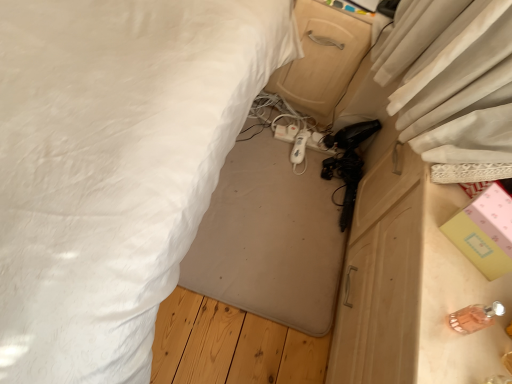
The height and width of the screenshot is (384, 512). What do you see at coordinates (114, 166) in the screenshot? I see `white fabric bed at center` at bounding box center [114, 166].

Find the location of a particular element. Image resolution: width=512 pixels, height=384 pixels. white matte remote control at center, positioned as the 2th equipment in right-to-left order is located at coordinates (298, 146).

Can you tell me how much white matte remote control at center, the 2th equipment from the front, and pink paper box at right differ in facing direction?

The facing directions of white matte remote control at center, the 2th equipment from the front, and pink paper box at right are 39 degrees apart.

In the scene shown: Does white matte remote control at center, positioned as the 2th equipment in right-to-left order, have a greater width compared to pink paper box at right?

Indeed, white matte remote control at center, positioned as the 2th equipment in right-to-left order, has a greater width compared to pink paper box at right.

Is white matte remote control at center, positioned as the first equipment in top-to-bottom order, directly adjacent to pink paper box at right?

They are not placed beside each other.

Who is shorter, white matte remote control at center, the 1th equipment from the left, or pink paper box at right?

With less height is white matte remote control at center, the 1th equipment from the left.

In the scene shown: Is wooden drawer at center in front of or behind translucent glass perfume bottle at lower right, which is the 2th equipment in back-to-front order, in the image?

wooden drawer at center is positioned farther from the viewer than translucent glass perfume bottle at lower right, which is the 2th equipment in back-to-front order.

Locate an element on the screen. equipment in front of the wooden drawer at center is located at coordinates (475, 317).

Which of these two, wooden drawer at center or translucent glass perfume bottle at lower right, the 2th equipment positioned from the left, stands taller?

Standing taller between the two is wooden drawer at center.

Can you tell me how much wooden drawer at center and translucent glass perfume bottle at lower right, marked as the first equipment in a front-to-back arrangement, differ in facing direction?

The facing directions of wooden drawer at center and translucent glass perfume bottle at lower right, marked as the first equipment in a front-to-back arrangement, are 86.8 degrees apart.

Is white plastic extension cord at center not within white fabric bed at center?

That's incorrect, white plastic extension cord at center is not completely outside white fabric bed at center.

Can you tell me how much white plastic extension cord at center and white fabric bed at center differ in facing direction?

The angle between the facing direction of white plastic extension cord at center and the facing direction of white fabric bed at center is 174 degrees.

Considering the relative sizes of white plastic extension cord at center and white fabric bed at center in the image provided, is white plastic extension cord at center bigger than white fabric bed at center?

No.

Is white plastic extension cord at center far from white fabric bed at center?

No, white plastic extension cord at center is not far from white fabric bed at center.

Is pink paper box at right completely or partially outside of wooden drawer at center?

pink paper box at right lies outside wooden drawer at center's area.

Considering the sizes of objects pink paper box at right and wooden drawer at center in the image provided, who is bigger, pink paper box at right or wooden drawer at center?

Bigger between the two is wooden drawer at center.

Is pink paper box at right further to the viewer compared to wooden drawer at center?

No, pink paper box at right is in front of wooden drawer at center.

From a real-world perspective, which is physically below, pink paper box at right or wooden drawer at center?

wooden drawer at center, from a real-world perspective.

From a real-world perspective, which is physically below, translucent glass perfume bottle at lower right, arranged as the 1th equipment when viewed from the right, or wooden drawer at center?

In real-world perspective, wooden drawer at center is lower.

Find the location of a particular element. equipment in front of the wooden drawer at center is located at coordinates (475, 317).

Are translucent glass perfume bottle at lower right, the 1th equipment ordered from the bottom, and wooden drawer at center beside each other?

No, translucent glass perfume bottle at lower right, the 1th equipment ordered from the bottom, is not next to wooden drawer at center.

In terms of width, does wooden drawer at center look wider or thinner when compared to white matte remote control at center, positioned as the 2th equipment in right-to-left order?

wooden drawer at center is wider than white matte remote control at center, positioned as the 2th equipment in right-to-left order.

Is wooden drawer at center completely or partially outside of white matte remote control at center, positioned as the 2th equipment in right-to-left order?

wooden drawer at center lies outside white matte remote control at center, positioned as the 2th equipment in right-to-left order,'s area.

Does wooden drawer at center have a smaller size compared to white matte remote control at center, acting as the second equipment starting from the bottom?

No, wooden drawer at center is not smaller than white matte remote control at center, acting as the second equipment starting from the bottom.

Visually, is wooden drawer at center positioned to the left or to the right of white matte remote control at center, positioned as the 2th equipment in right-to-left order?

wooden drawer at center is positioned on white matte remote control at center, positioned as the 2th equipment in right-to-left order,'s right side.

Is wooden drawer at center touching pink paper box at right?

No, wooden drawer at center is not next to pink paper box at right.

How far apart are wooden drawer at center and pink paper box at right?

wooden drawer at center is 34.37 inches away from pink paper box at right.

Is pink paper box at right at the back of wooden drawer at center?

No, wooden drawer at center is not facing the opposite direction of pink paper box at right.

From the image's perspective, is wooden drawer at center on pink paper box at right?

Yes, from the image's perspective, wooden drawer at center is on top of pink paper box at right.

This screenshot has width=512, height=384. What are the coordinates of `box that appears on the right of white matte remote control at center, placed as the first equipment when sorted from back to front` in the screenshot? It's located at (485, 231).

The image size is (512, 384). Identify the location of drawer behind the translucent glass perfume bottle at lower right, marked as the first equipment in a front-to-back arrangement. (321, 58).

From the image, which object appears to be nearer to white fabric bed at center, translucent glass perfume bottle at lower right, marked as the first equipment in a front-to-back arrangement, or white matte remote control at center, the 2th equipment from the front?

translucent glass perfume bottle at lower right, marked as the first equipment in a front-to-back arrangement, is closer to white fabric bed at center.

From the image, which object appears to be nearer to white matte remote control at center, acting as the second equipment starting from the bottom, translucent glass perfume bottle at lower right, the second equipment in the top-to-bottom sequence, or white fabric bed at center?

white fabric bed at center is closer to white matte remote control at center, acting as the second equipment starting from the bottom.

Estimate the real-world distances between objects in this image. Which object is closer to pink paper box at right, translucent glass perfume bottle at lower right, arranged as the 1th equipment when viewed from the right, or wooden drawer at center?

translucent glass perfume bottle at lower right, arranged as the 1th equipment when viewed from the right, is positioned closer to the anchor pink paper box at right.

Based on their spatial positions, is pink paper box at right or white fabric bed at center further from white plastic extension cord at center?

pink paper box at right is further to white plastic extension cord at center.

Estimate the real-world distances between objects in this image. Which object is closer to pink paper box at right, white matte remote control at center, positioned as the first equipment in top-to-bottom order, or translucent glass perfume bottle at lower right, arranged as the 1th equipment when viewed from the right?

Based on the image, translucent glass perfume bottle at lower right, arranged as the 1th equipment when viewed from the right, appears to be nearer to pink paper box at right.

Based on their spatial positions, is white fabric bed at center or pink paper box at right further from wooden drawer at center?

pink paper box at right is further to wooden drawer at center.

Looking at the image, which one is located further to translucent glass perfume bottle at lower right, marked as the first equipment in a front-to-back arrangement, wooden drawer at center or white fabric bed at center?

wooden drawer at center.

Which object lies further to the anchor point pink paper box at right, white matte remote control at center, acting as the second equipment starting from the bottom, or white fabric bed at center?

white matte remote control at center, acting as the second equipment starting from the bottom.

Where is `drawer between pink paper box at right and white plastic extension cord at center along the z-axis`? The height and width of the screenshot is (384, 512). drawer between pink paper box at right and white plastic extension cord at center along the z-axis is located at coordinates (321, 58).

Where is `bed between wooden drawer at center and pink paper box at right in the up-down direction`? bed between wooden drawer at center and pink paper box at right in the up-down direction is located at coordinates (114, 166).

Find the location of a particular element. The image size is (512, 384). equipment between pink paper box at right and white plastic extension cord at center along the z-axis is located at coordinates (298, 146).

Identify the location of extension cord between wooden drawer at center and white fabric bed at center from top to bottom. The image size is (512, 384). (286, 132).